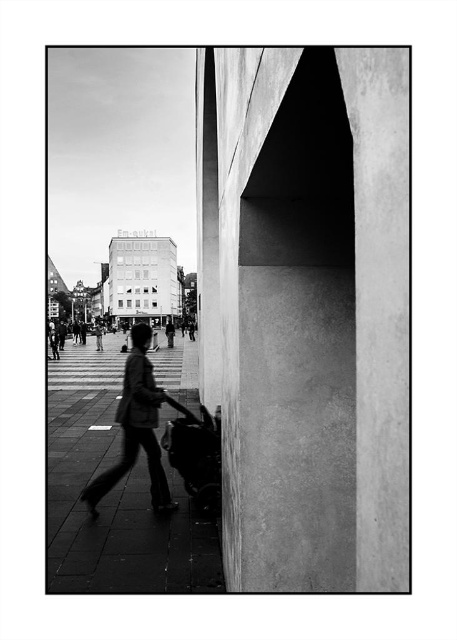
Is smooth concrete sidewalk at center above matte black jacket at center?

No.

Who is more distant from viewer, (70, 502) or (149, 378)?

Positioned behind is point (149, 378).

Find the location of a particular element. smooth concrete sidewalk at center is located at coordinates (112, 493).

Which is more to the left, matte black jacket at center or metallic smooth baby carriage at center?

From the viewer's perspective, matte black jacket at center appears more on the left side.

Can you confirm if matte black jacket at center is smaller than metallic smooth baby carriage at center?

Incorrect, matte black jacket at center is not smaller in size than metallic smooth baby carriage at center.

Who is more distant from viewer, (109,483) or (197,504)?

Positioned behind is point (109,483).

Identify the location of matte black jacket at center. The width and height of the screenshot is (457, 640). (136, 428).

Can you confirm if smooth concrete pillar at center is thinner than smooth concrete sidewalk at center?

Yes.

Does point (212, 262) come closer to viewer compared to point (88, 355)?

Yes, it is.

You are a GUI agent. You are given a task and a screenshot of the screen. Output one action in this format:
    pyautogui.click(x=<x>, y=<y>)
    Task: Click on the smooth concrete pillar at center
    The height and width of the screenshot is (640, 457).
    Given the screenshot: What is the action you would take?
    pyautogui.click(x=308, y=308)

Identify the location of smooth concrete pillar at center. This screenshot has height=640, width=457. (308, 308).